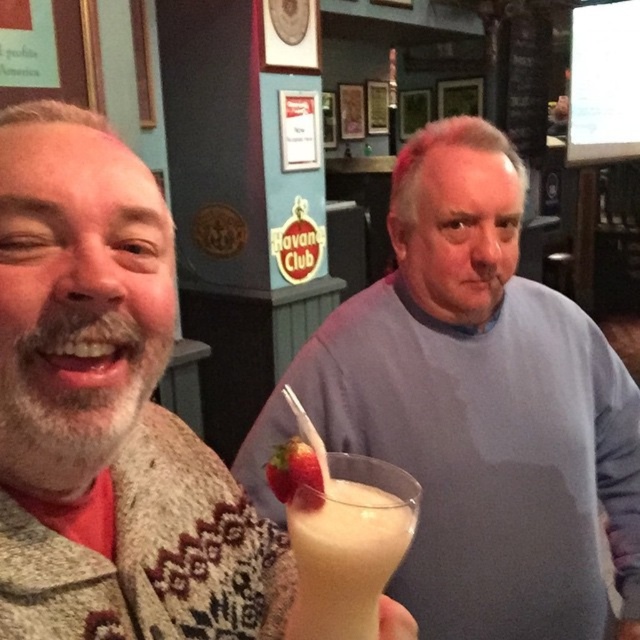
Question: Which point is closer to the camera?

Choices:
 (A) (371, 628)
 (B) (458, 464)
 (C) (54, 497)

Answer: (A)

Question: Does gray matte sweater at center appear under knitted sweater at left?

Choices:
 (A) yes
 (B) no

Answer: (A)

Question: Which of the following is the farthest from the observer?

Choices:
 (A) white frothy milkshake at center
 (B) knitted sweater at left
 (C) gray matte sweater at center

Answer: (C)

Question: In this image, where is gray matte sweater at center located relative to knitted sweater at left?

Choices:
 (A) below
 (B) above

Answer: (A)

Question: Can you confirm if knitted sweater at left is wider than white frothy milkshake at center?

Choices:
 (A) yes
 (B) no

Answer: (A)

Question: Which of the following is the farthest from the observer?

Choices:
 (A) gray matte sweater at center
 (B) knitted sweater at left
 (C) white frothy milkshake at center

Answer: (A)